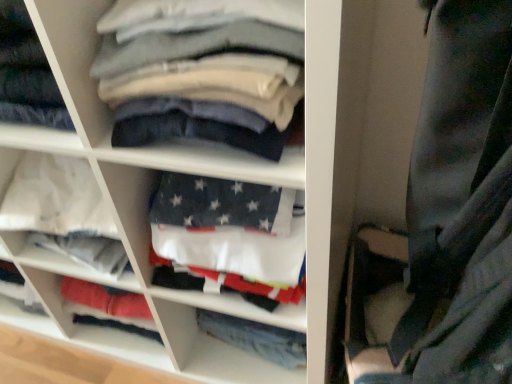
Question: Is the position of smooth cotton shirts at center more distant than that of white fabric at center?

Choices:
 (A) no
 (B) yes

Answer: (A)

Question: Does smooth cotton shirts at center turn towards white fabric at center?

Choices:
 (A) no
 (B) yes

Answer: (A)

Question: Is smooth cotton shirts at center bigger than white fabric at center?

Choices:
 (A) no
 (B) yes

Answer: (A)

Question: Is smooth cotton shirts at center to the left of white fabric at center from the viewer's perspective?

Choices:
 (A) yes
 (B) no

Answer: (B)

Question: Can you confirm if smooth cotton shirts at center is shorter than white fabric at center?

Choices:
 (A) yes
 (B) no

Answer: (A)

Question: Can you confirm if smooth cotton shirts at center is taller than white fabric at center?

Choices:
 (A) yes
 (B) no

Answer: (B)

Question: Is white cotton shirts at center outside denim pants at center?

Choices:
 (A) no
 (B) yes

Answer: (B)

Question: Considering the relative sizes of white cotton shirts at center and denim pants at center in the image provided, is white cotton shirts at center shorter than denim pants at center?

Choices:
 (A) no
 (B) yes

Answer: (A)

Question: From the image's perspective, is white cotton shirts at center on top of denim pants at center?

Choices:
 (A) yes
 (B) no

Answer: (A)

Question: Is white cotton shirts at center oriented towards denim pants at center?

Choices:
 (A) no
 (B) yes

Answer: (B)

Question: Does white cotton shirts at center have a smaller size compared to denim pants at center?

Choices:
 (A) yes
 (B) no

Answer: (B)

Question: Considering the relative positions of white cotton shirts at center and denim pants at center in the image provided, is white cotton shirts at center behind denim pants at center?

Choices:
 (A) no
 (B) yes

Answer: (A)

Question: From the image's perspective, would you say denim pants at center is positioned over white cotton shirts at center?

Choices:
 (A) no
 (B) yes

Answer: (A)